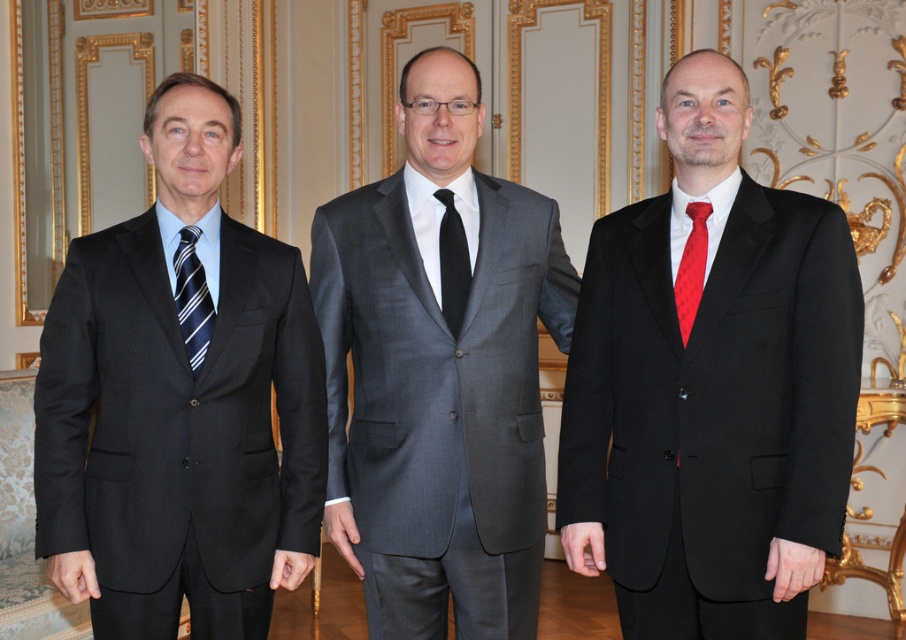
Question: Is gray wool suit at center in front of striped fabric tie at left?

Choices:
 (A) yes
 (B) no

Answer: (B)

Question: Which point is closer to the camera?

Choices:
 (A) red satin tie at center
 (B) matte black suit at left
 (C) gray wool suit at center
 (D) striped fabric tie at left

Answer: (B)

Question: Does matte black suit at right have a greater width compared to matte black suit at left?

Choices:
 (A) yes
 (B) no

Answer: (A)

Question: Among these points, which one is nearest to the camera?

Choices:
 (A) (699, 243)
 (B) (121, 388)
 (C) (355, 240)
 (D) (718, 461)

Answer: (D)

Question: Which point appears closest to the camera in this image?

Choices:
 (A) (762, 515)
 (B) (465, 296)
 (C) (188, 248)

Answer: (A)

Question: Is gray wool suit at center positioned before red satin tie at center?

Choices:
 (A) yes
 (B) no

Answer: (B)